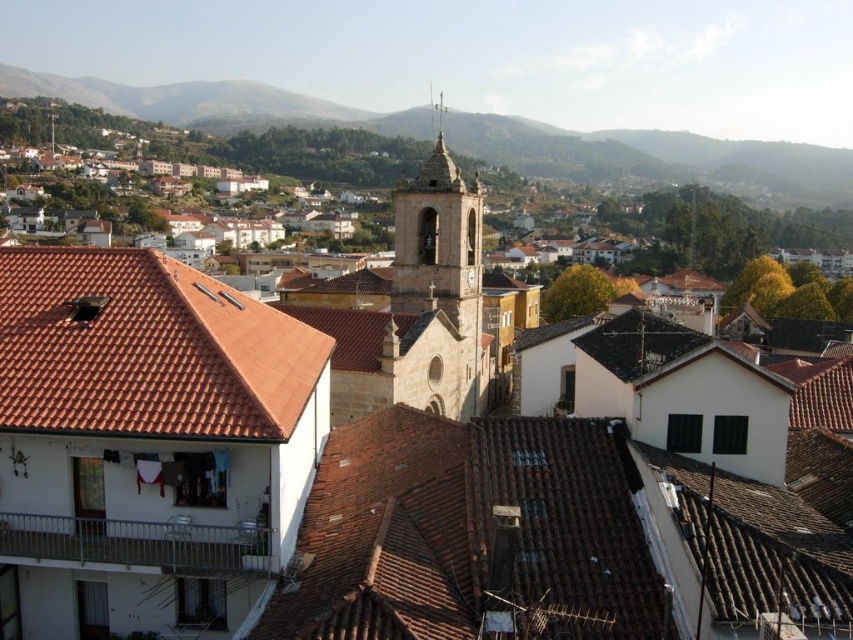
Find the location of a particular element. This screenshot has height=640, width=853. red tile roof at left is located at coordinates (144, 348).

Can you confirm if red tile roof at left is positioned to the left of shiny silver spire at upper center?

Correct, you'll find red tile roof at left to the left of shiny silver spire at upper center.

Who is more distant from viewer, (206,316) or (437,112)?

Point (437,112)

Identify the location of red tile roof at left. (144, 348).

In the scene shown: Between red tile roof at left and stone bell tower at center, which one is positioned higher?

stone bell tower at center is higher up.

Is red tile roof at left behind stone bell tower at center?

No, red tile roof at left is in front of stone bell tower at center.

Is point (61, 278) positioned behind point (466, 243)?

No.

Locate an element on the screen. red tile roof at left is located at coordinates click(x=144, y=348).

Does stone bell tower at center have a larger size compared to shiny silver spire at upper center?

Incorrect, stone bell tower at center is not larger than shiny silver spire at upper center.

Measure the distance from stone bell tower at center to shiny silver spire at upper center.

stone bell tower at center and shiny silver spire at upper center are 120.18 feet apart from each other.

Find the location of `stone bell tower at center`. stone bell tower at center is located at coordinates (438, 289).